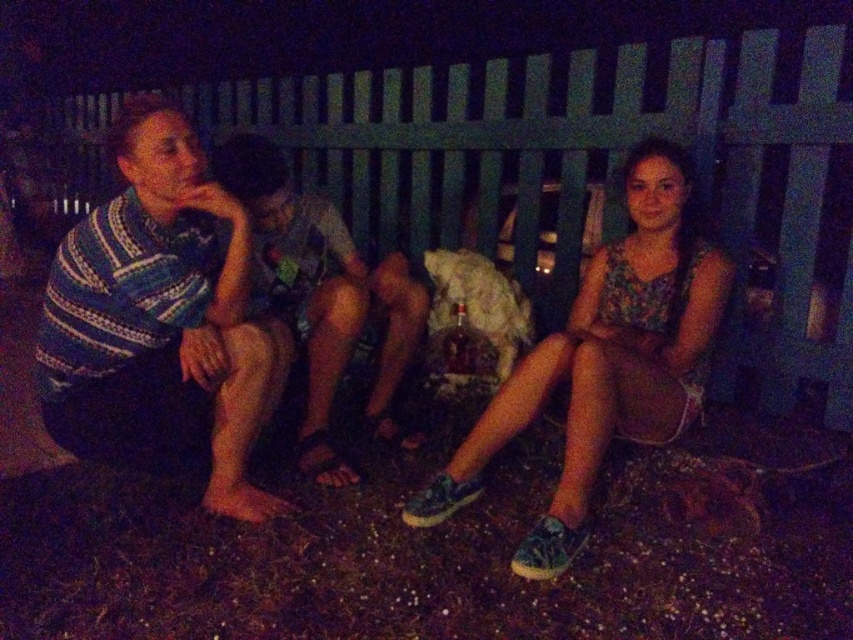
You are standing in the scene and want to throw a small ball to the striped knit shirt at center without it hitting the green wooden fence at upper center. Is this possible?

The green wooden fence at upper center is closer to the viewer than the striped knit shirt at center, so the ball would hit the fence before reaching the target.

You are standing in the scene and want to place a small decorative item between the two points, point (677, 408) and point (344, 241). Which point should you place it closer to in order for it to appear larger to someone looking at the scene from your perspective?

You should place the item closer to point (677, 408) because it is closer to the viewer than point (344, 241). Objects placed closer to the viewer appear larger.